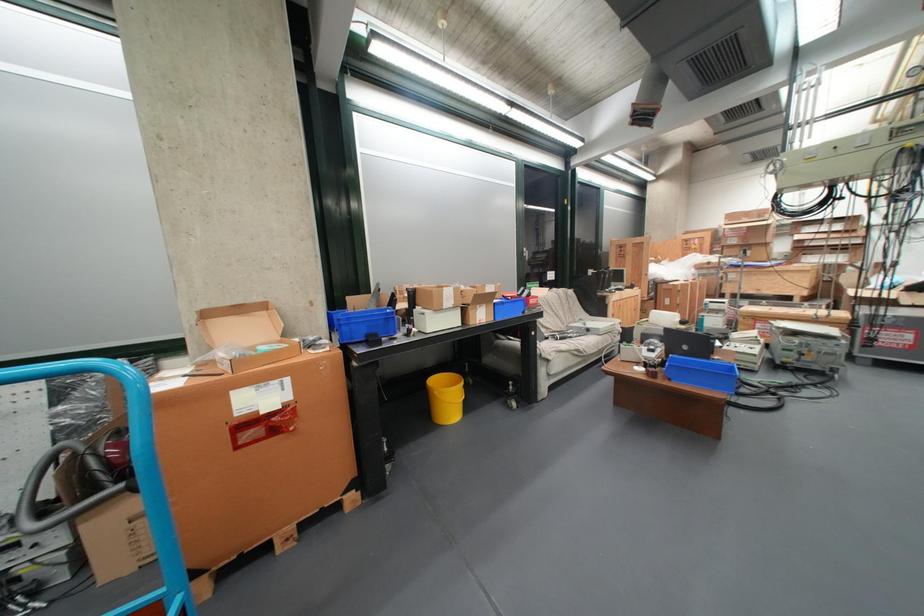
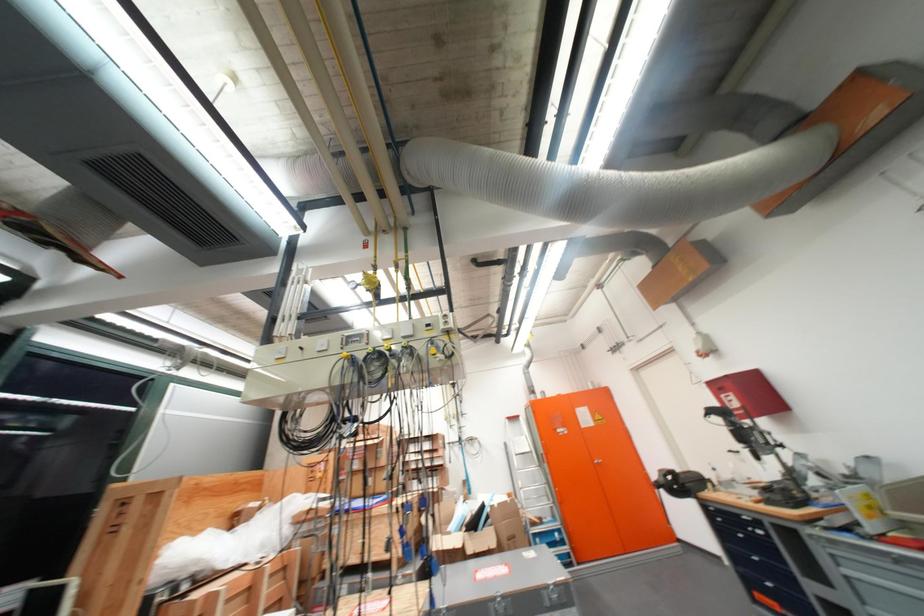
Locate, in the second image, the point that corresponds to (x=676, y=286) in the first image.

(187, 610)